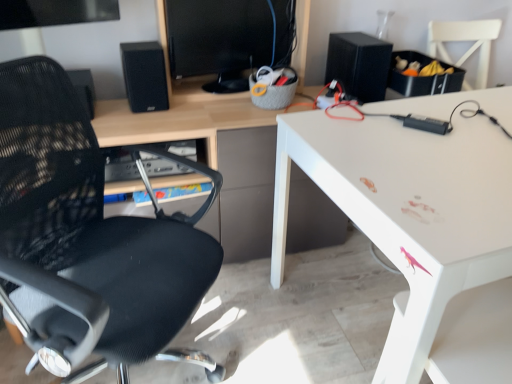
Question: Does black matte speaker at upper left, marked as the second speaker in a right-to-left arrangement, have a greater height compared to black mesh chair at left?

Choices:
 (A) no
 (B) yes

Answer: (A)

Question: Is black matte speaker at upper left, the 1th speaker positioned from the left, far from black mesh chair at left?

Choices:
 (A) no
 (B) yes

Answer: (A)

Question: Does black matte speaker at upper left, marked as the second speaker in a right-to-left arrangement, have a lesser height compared to black mesh chair at left?

Choices:
 (A) yes
 (B) no

Answer: (A)

Question: From a real-world perspective, does black matte speaker at upper left, the 1th speaker positioned from the left, stand above black mesh chair at left?

Choices:
 (A) no
 (B) yes

Answer: (B)

Question: From the image's perspective, would you say black matte speaker at upper left, the 1th speaker positioned from the left, is shown under black mesh chair at left?

Choices:
 (A) no
 (B) yes

Answer: (A)

Question: In terms of width, does black glossy monitor at upper center look wider or thinner when compared to black matte speaker at upper right, the second speaker from the left?

Choices:
 (A) thin
 (B) wide

Answer: (A)

Question: From their relative heights in the image, would you say black glossy monitor at upper center is taller or shorter than black matte speaker at upper right, the second speaker from the left?

Choices:
 (A) short
 (B) tall

Answer: (B)

Question: Is black glossy monitor at upper center inside or outside of black matte speaker at upper right, the second speaker from the left?

Choices:
 (A) outside
 (B) inside

Answer: (A)

Question: In the image, is black glossy monitor at upper center positioned in front of or behind black matte speaker at upper right, the 1th speaker when ordered from right to left?

Choices:
 (A) behind
 (B) front

Answer: (B)

Question: Looking at the image, does black glossy monitor at upper center seem bigger or smaller compared to black matte speaker at upper left, the 1th speaker positioned from the left?

Choices:
 (A) big
 (B) small

Answer: (A)

Question: Is point (170, 51) closer or farther from the camera than point (155, 79)?

Choices:
 (A) closer
 (B) farther

Answer: (B)

Question: Relative to black matte speaker at upper left, the 1th speaker positioned from the left, is black glossy monitor at upper center in front or behind?

Choices:
 (A) front
 (B) behind

Answer: (A)

Question: From a real-world perspective, is black glossy monitor at upper center physically located above or below black matte speaker at upper left, the 1th speaker positioned from the left?

Choices:
 (A) below
 (B) above

Answer: (B)

Question: Considering the positions of black matte speaker at upper left, the 1th speaker positioned from the left, and white glossy desk at upper right in the image, is black matte speaker at upper left, the 1th speaker positioned from the left, bigger or smaller than white glossy desk at upper right?

Choices:
 (A) small
 (B) big

Answer: (A)

Question: Is black matte speaker at upper left, marked as the second speaker in a right-to-left arrangement, in front of or behind white glossy desk at upper right in the image?

Choices:
 (A) behind
 (B) front

Answer: (A)